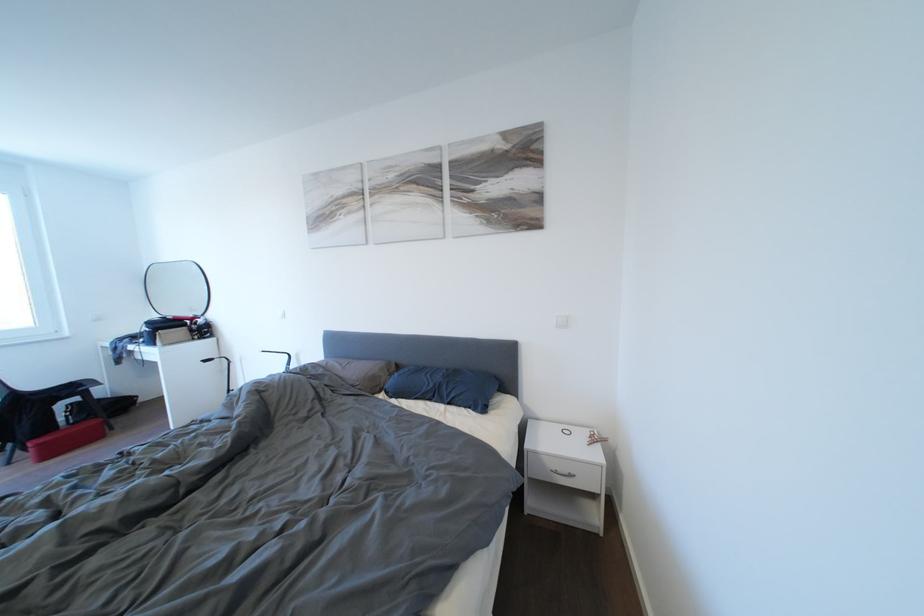
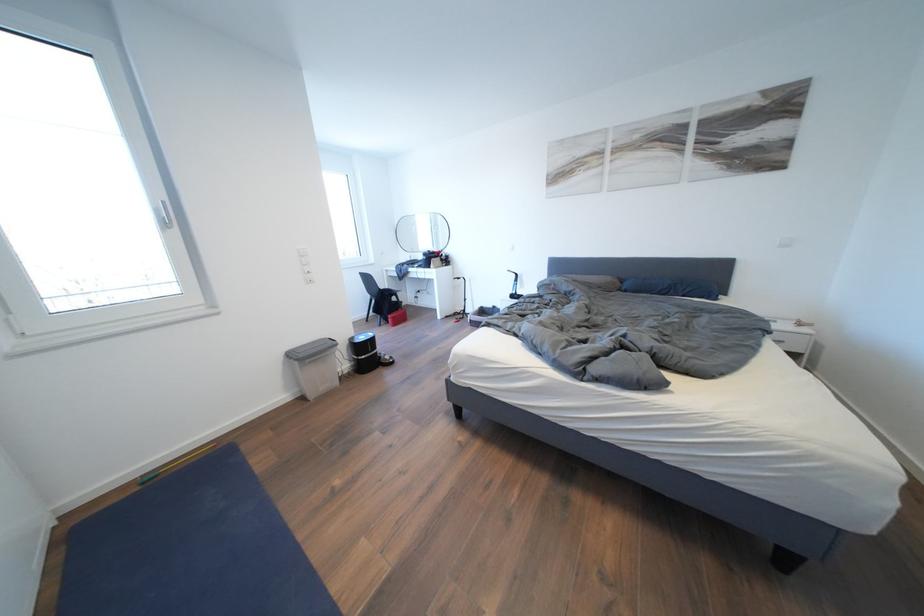
What movement of the cameraman would produce the second image?

The cameraman moved toward left, backward.